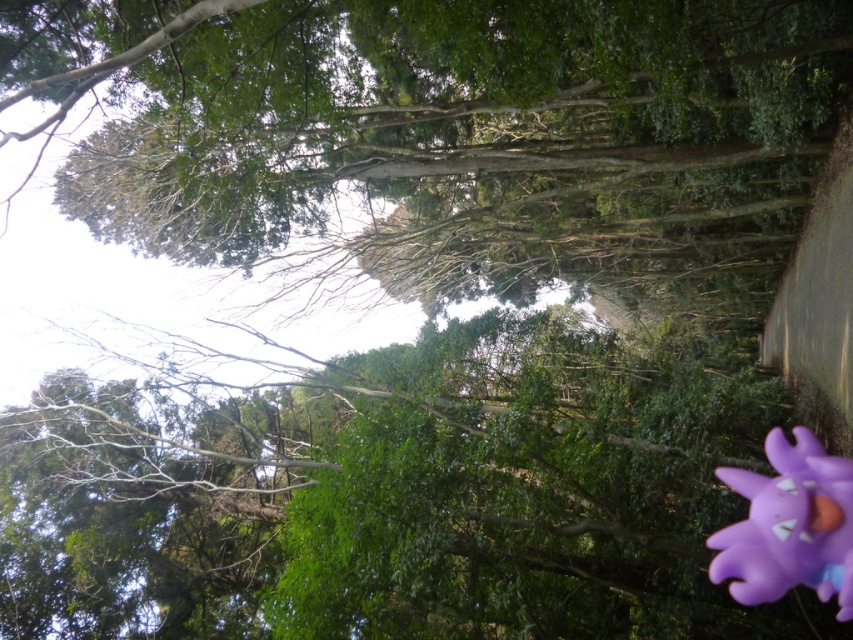
You are standing in a forest and want to take a photo of the green leafy tree at center. If your camera can focus on objects up to 5 meters away, will it be able to capture the tree clearly?

The green leafy tree at center is 4.79 meters away from the viewer. Since the camera can focus up to 5 meters, it will be able to capture the tree clearly.

You are standing in the forest looking up at the trees. There are two points marked in the scene, point A at coordinates point (711, 273) and point B at coordinates point (776, 557). Which point is closer to your eyes?

Point A at coordinates point (711, 273) is closer to your eyes since it is further to the camera than point B at coordinates point (776, 557).

You are a hiker who has just found a purple matte toy at lower right in a dense forest. You want to take a photo of the green leafy tree at center with the toy in the frame. Which direction should you move to ensure both are visible?

The green leafy tree at center is to the left of the purple matte toy at lower right. To include both in your photo, move to the right side of the purple matte toy at lower right so that the tree appears on the left and the toy stays in the frame.